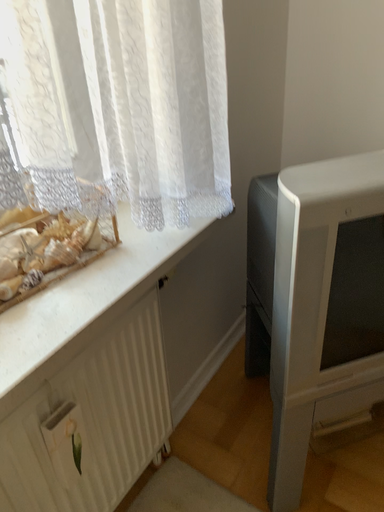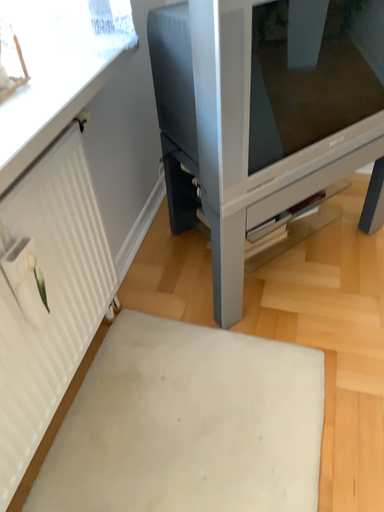
Question: How did the camera likely rotate when shooting the video?

Choices:
 (A) rotated left
 (B) rotated right

Answer: (B)